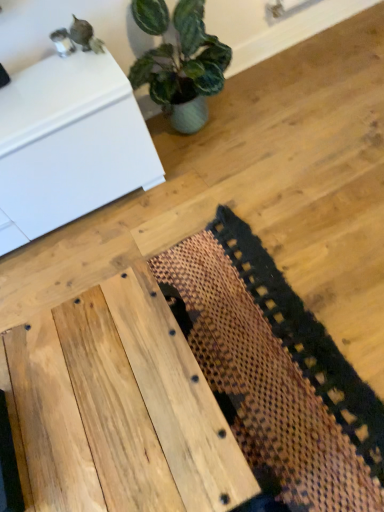
Question: From the image's perspective, is natural wood table at center above or below brown woven mat at center?

Choices:
 (A) below
 (B) above

Answer: (A)

Question: From a real-world perspective, is natural wood table at center positioned above or below brown woven mat at center?

Choices:
 (A) above
 (B) below

Answer: (A)

Question: Estimate the real-world distances between objects in this image. Which object is farther from the natural wood table at center?

Choices:
 (A) white glossy cabinet at upper left
 (B) brown woven mat at center

Answer: (A)

Question: Which of these objects is positioned closest to the natural wood table at center?

Choices:
 (A) white glossy cabinet at upper left
 (B) brown woven mat at center

Answer: (B)